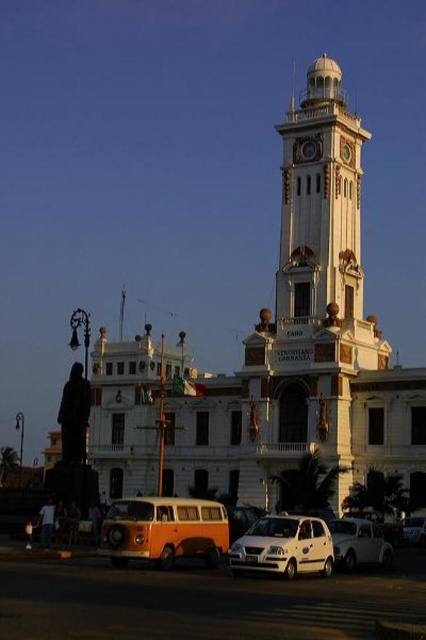
Question: Which object is positioned farthest from the white painted stone clock tower at upper center?

Choices:
 (A) white matte car at lower right
 (B) white matte car at center

Answer: (A)

Question: Which of the following is the farthest from the observer?

Choices:
 (A) (420, 529)
 (B) (370, 323)
 (C) (288, 538)

Answer: (B)

Question: Observing the image, what is the correct spatial positioning of white matte car at lower right in reference to white matte car at center?

Choices:
 (A) right
 (B) left

Answer: (B)

Question: Considering the relative positions of white matte car at lower right and white matte car at center in the image provided, where is white matte car at lower right located with respect to white matte car at center?

Choices:
 (A) below
 (B) above

Answer: (B)

Question: Observing the image, what is the correct spatial positioning of white matte car at lower center in reference to white matte car at center?

Choices:
 (A) right
 (B) left

Answer: (B)

Question: Which point appears farthest from the camera in this image?

Choices:
 (A) (327, 561)
 (B) (408, 524)
 (C) (367, 520)
 (D) (328, 237)

Answer: (D)